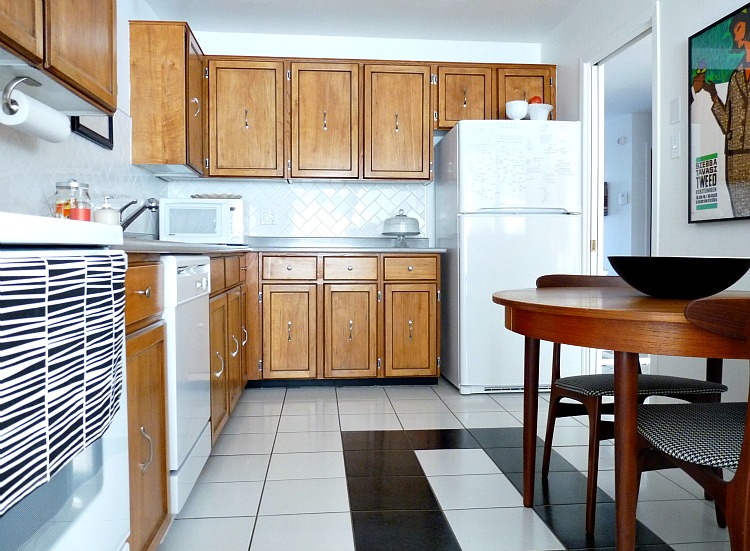
Identify the location of cabinets. (348, 134).